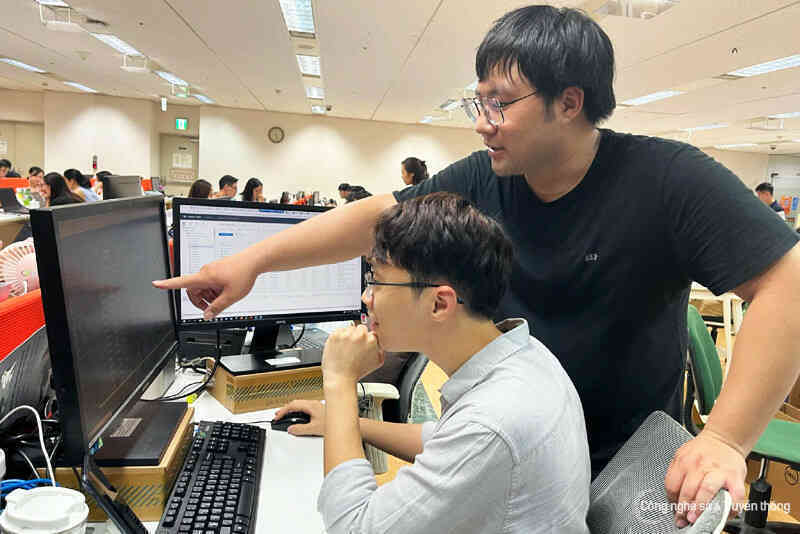
Locate an element on the screen. This screenshot has height=534, width=800. clock is located at coordinates (272, 130).